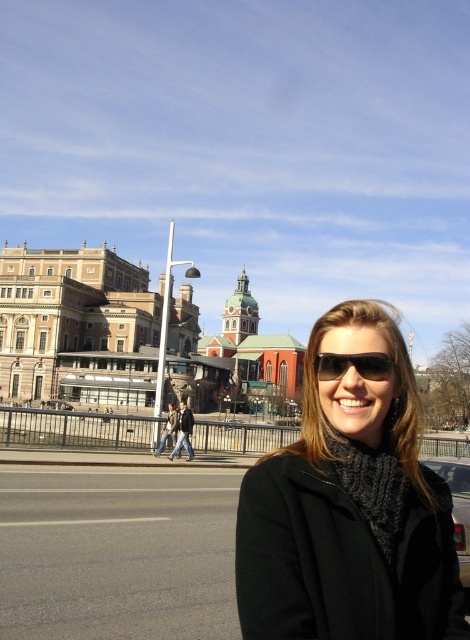
Is black woolen scarf at center closer to the viewer compared to black matte car at lower right?

Yes.

Between black woolen scarf at center and black matte car at lower right, which one has less height?

Standing shorter between the two is black matte car at lower right.

Which is in front, point (323, 522) or point (462, 477)?

Point (323, 522) is in front.

This screenshot has height=640, width=470. I want to click on black woolen scarf at center, so tap(350, 508).

Can you confirm if black leather jacket at center is positioned above silver metallic car at center?

No, black leather jacket at center is not above silver metallic car at center.

Consider the image. Between black leather jacket at center and silver metallic car at center, which one is positioned lower?

black leather jacket at center

Find the location of a particular element. black leather jacket at center is located at coordinates (183, 433).

Does black plastic sunglasses at center have a lesser width compared to silver metallic car at center?

Indeed, black plastic sunglasses at center has a lesser width compared to silver metallic car at center.

Is black plastic sunglasses at center to the right of silver metallic car at center from the viewer's perspective?

Correct, you'll find black plastic sunglasses at center to the right of silver metallic car at center.

Between point (324, 378) and point (52, 401), which one is positioned in front?

Point (324, 378)

You are a GUI agent. You are given a task and a screenshot of the screen. Output one action in this format:
    pyautogui.click(x=<x>, y=<y>)
    Task: Click on the black plastic sunglasses at center
    
    Given the screenshot: What is the action you would take?
    pyautogui.click(x=352, y=365)